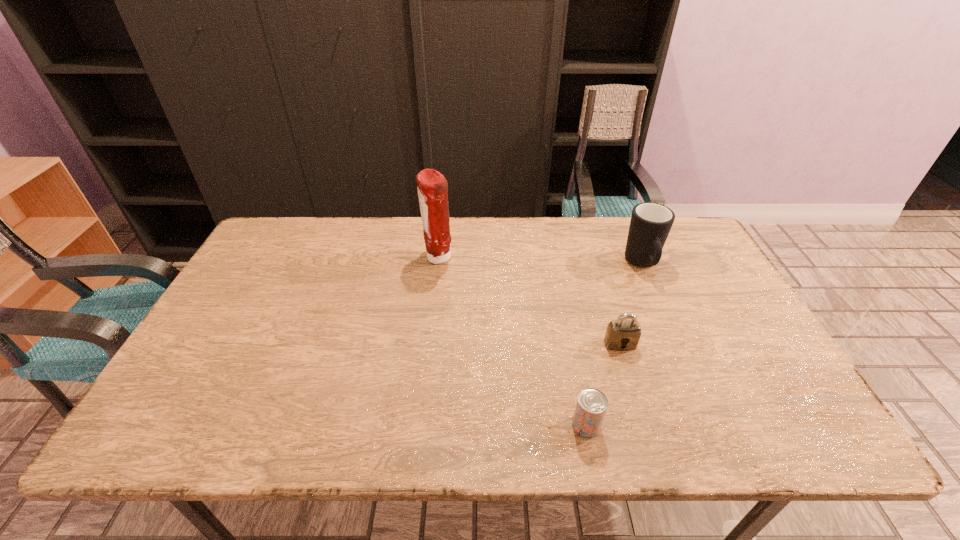
Where is `free location located at the front of the third farthest object near the keyhole`? The width and height of the screenshot is (960, 540). free location located at the front of the third farthest object near the keyhole is located at coordinates (646, 428).

I want to click on vacant space located on the back of the nearest object, so click(x=565, y=323).

Locate an element on the screen. The height and width of the screenshot is (540, 960). condiment at the far edge is located at coordinates (432, 187).

This screenshot has height=540, width=960. What are the coordinates of `mug situated at the far edge` in the screenshot? It's located at coord(650,224).

Image resolution: width=960 pixels, height=540 pixels. I want to click on object located in the near edge section of the desktop, so click(x=591, y=406).

What are the coordinates of `object present at the right edge` in the screenshot? It's located at (650, 224).

Locate an element on the screen. This screenshot has height=540, width=960. object present at the far right corner is located at coordinates (650, 224).

This screenshot has width=960, height=540. What are the coordinates of `free space at the far edge of the desktop` in the screenshot? It's located at (625, 251).

You are a GUI agent. You are given a task and a screenshot of the screen. Output one action in this format:
    pyautogui.click(x=<x>, y=<y>)
    Task: Click on the free space at the near edge
    Image resolution: width=960 pixels, height=540 pixels.
    Given the screenshot: What is the action you would take?
    pyautogui.click(x=444, y=424)

At what (x,y) coordinates should I click in order to perform the action: click on free space at the right edge of the desktop. Please return your answer as a coordinate pair (x, y). Image resolution: width=960 pixels, height=540 pixels. Looking at the image, I should click on (699, 303).